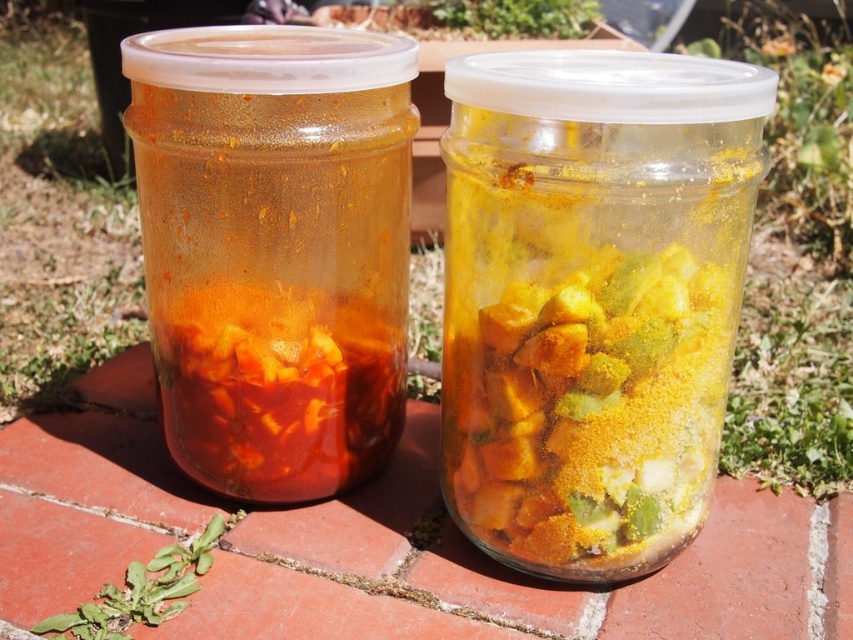
You are standing in front of two jars on a red brick surface. You need to reach the point that is closer to you. Which point should you aim for, point at (x=532, y=403) or point at (x=407, y=125)?

Point at (x=532, y=403) is in front of point at (x=407, y=125), so you should aim for point at (x=532, y=403) as it is closer to you.

You are a delivery person who needs to place a third jar between the yellow translucent jar at center and the translucent glass jar at left. The third jar is 3 inches in diameter. Can you fit it between them without moving the existing jars?

The distance between the yellow translucent jar at center and the translucent glass jar at left is 8.72 inches. Since the third jar is 3 inches in diameter, there is enough space to place it between them without moving the existing jars.

You are standing 20 inches away from the jars. Can you reach the point at (608,340) without moving closer?

The point at (608,340) is 31.26 inches from the viewer. Since you are only 20 inches away, you are still 11.26 inches too far to reach it without moving closer.